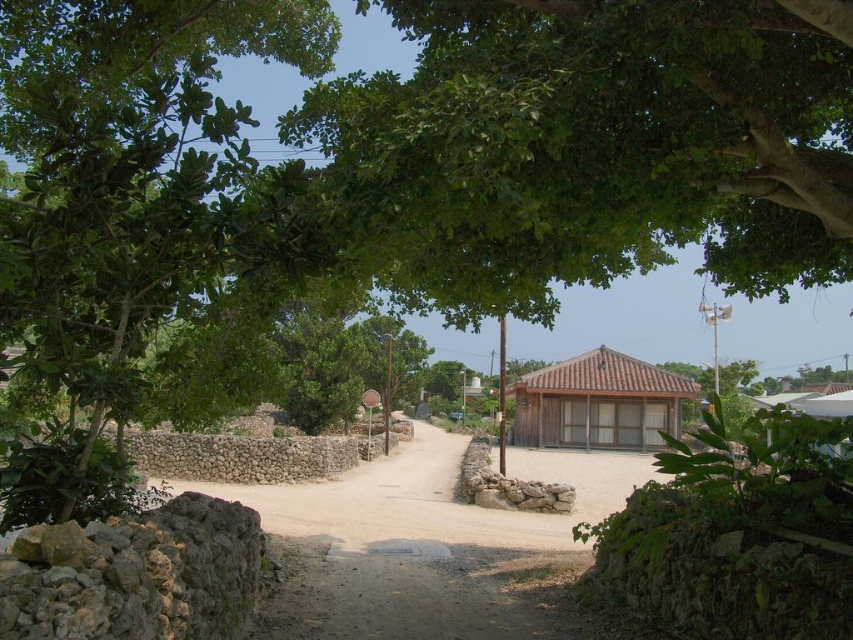
Who is positioned more to the right, green leafy tree at left or brown wooden hut at center?

brown wooden hut at center

Is green leafy tree at left taller than brown wooden hut at center?

Incorrect, green leafy tree at left's height is not larger of brown wooden hut at center's.

This screenshot has height=640, width=853. I want to click on green leafy tree at left, so click(122, 180).

Where is `green leafy tree at left`? This screenshot has height=640, width=853. green leafy tree at left is located at coordinates tap(122, 180).